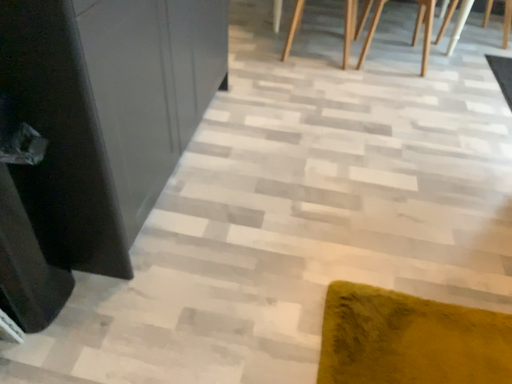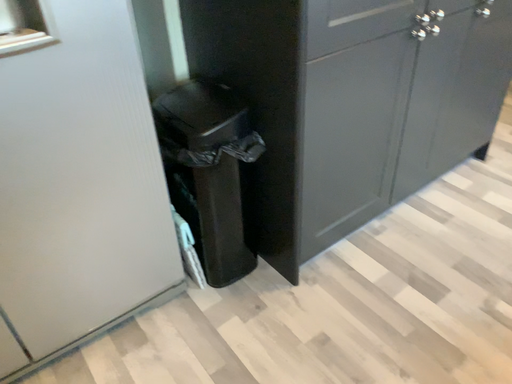
Question: Which way did the camera rotate in the video?

Choices:
 (A) rotated downward
 (B) rotated upward

Answer: (B)